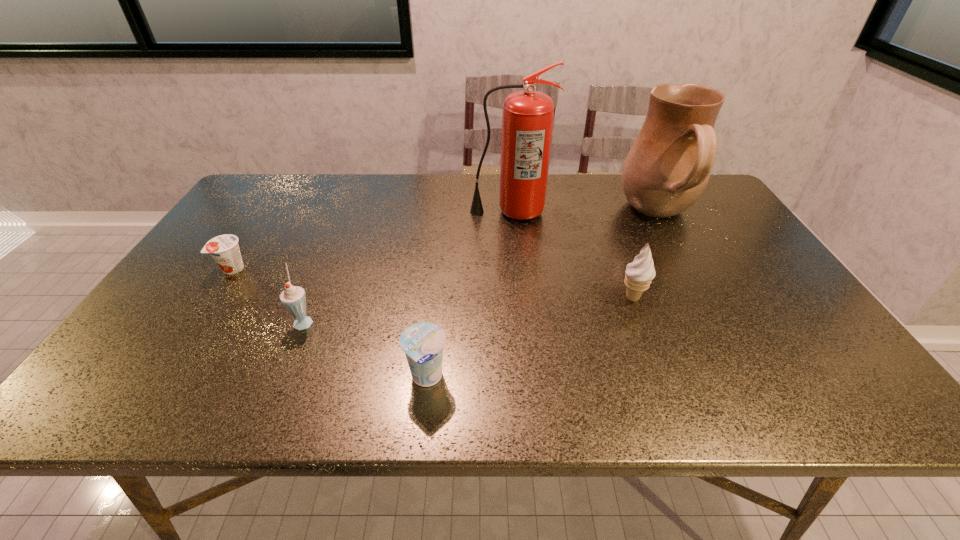
Where is `the tallest object`? the tallest object is located at coordinates (527, 121).

This screenshot has width=960, height=540. I want to click on fire extinguisher, so click(527, 121).

The image size is (960, 540). Find the location of `cream pitcher`. cream pitcher is located at coordinates (667, 169).

Locate an element on the screen. The height and width of the screenshot is (540, 960). the rightmost object is located at coordinates (667, 169).

Where is `the fourth farthest object`? the fourth farthest object is located at coordinates (638, 275).

Where is `the second object from right to left`? The height and width of the screenshot is (540, 960). the second object from right to left is located at coordinates (638, 275).

Where is `the second object from left to right`? This screenshot has height=540, width=960. the second object from left to right is located at coordinates (293, 298).

The image size is (960, 540). I want to click on the second nearest object, so click(x=293, y=298).

The height and width of the screenshot is (540, 960). Find the location of `the right yogurt`. the right yogurt is located at coordinates (423, 343).

Identify the location of the nearer yogurt. Image resolution: width=960 pixels, height=540 pixels. (423, 343).